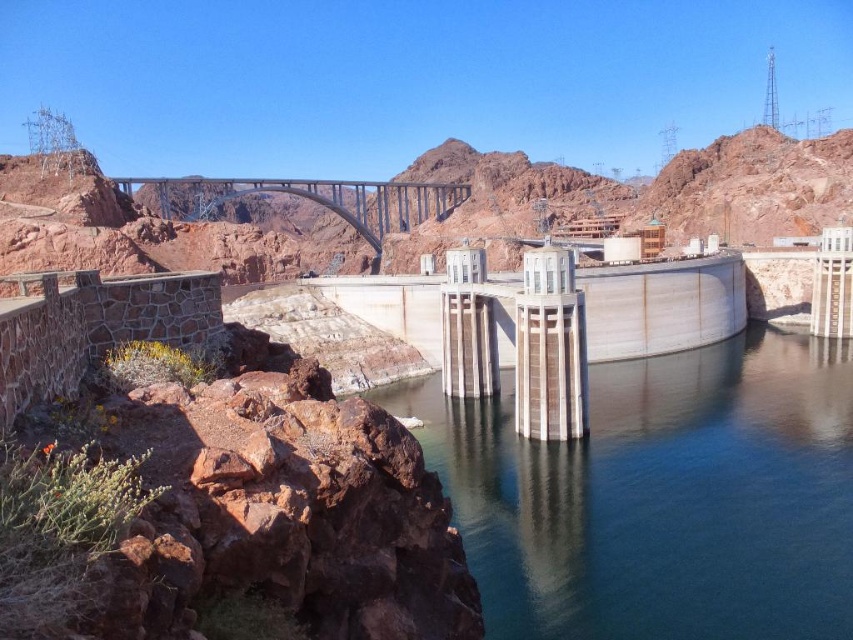
Is clear blue water at center below metallic gray bridge at center?

Yes.

Who is more distant from viewer, (815, 624) or (403, 208)?

The point (403, 208) is behind.

Where is `clear blue water at center`? This screenshot has width=853, height=640. clear blue water at center is located at coordinates (660, 497).